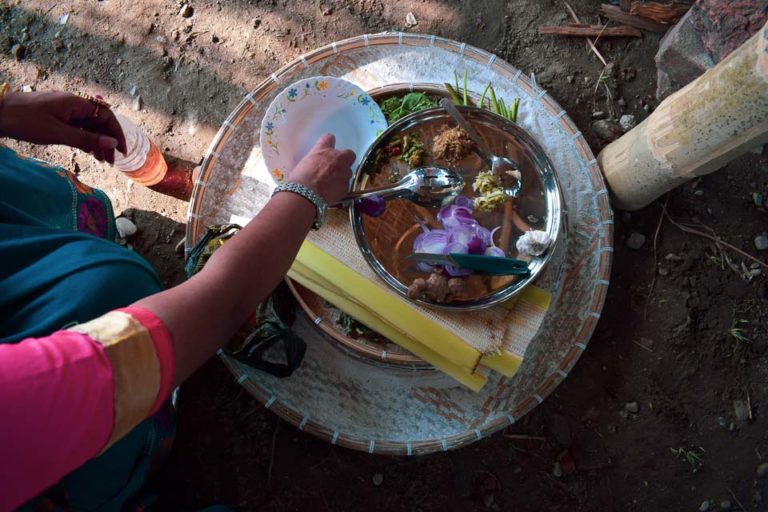
The image size is (768, 512). What are the coordinates of `basket` in the screenshot? It's located at (x=372, y=413).